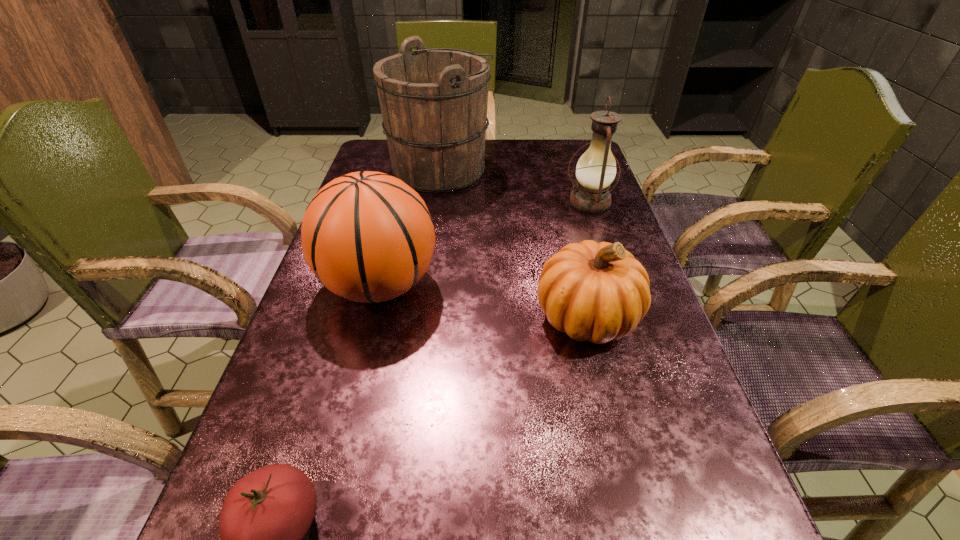
Find the location of `basketball situated at the left edge`. basketball situated at the left edge is located at coordinates (368, 237).

Image resolution: width=960 pixels, height=540 pixels. I want to click on oil lamp that is at the right edge, so click(x=596, y=169).

The width and height of the screenshot is (960, 540). I want to click on pumpkin at the right edge, so click(x=599, y=292).

Image resolution: width=960 pixels, height=540 pixels. I want to click on object that is at the far left corner, so click(x=433, y=102).

At what (x,y) coordinates should I click in order to perform the action: click on vacant area at the far edge. Please return your answer as a coordinate pair (x, y). The height and width of the screenshot is (540, 960). Looking at the image, I should click on (486, 141).

You are a GUI agent. You are given a task and a screenshot of the screen. Output one action in this format:
    pyautogui.click(x=<x>, y=<y>)
    Task: Click on the vacant position at the left edge of the desktop
    This screenshot has height=540, width=960.
    Given the screenshot: What is the action you would take?
    pyautogui.click(x=238, y=462)

Identify the location of vacant region at the right edge. The image size is (960, 540). (652, 314).

In the image, there is a desktop. At what (x,y) coordinates should I click in order to perform the action: click on vacant region at the far left corner. Please return your answer as a coordinate pair (x, y). The image size is (960, 540). Looking at the image, I should click on click(x=371, y=140).

You are a GUI agent. You are given a task and a screenshot of the screen. Output one action in this format:
    pyautogui.click(x=<x>, y=<y>)
    Task: Click on the free space between the basketball and the fourth tallest object
    
    Given the screenshot: What is the action you would take?
    pyautogui.click(x=484, y=301)

The image size is (960, 540). I want to click on empty location between the fourth tallest object and the bucket, so click(x=514, y=243).